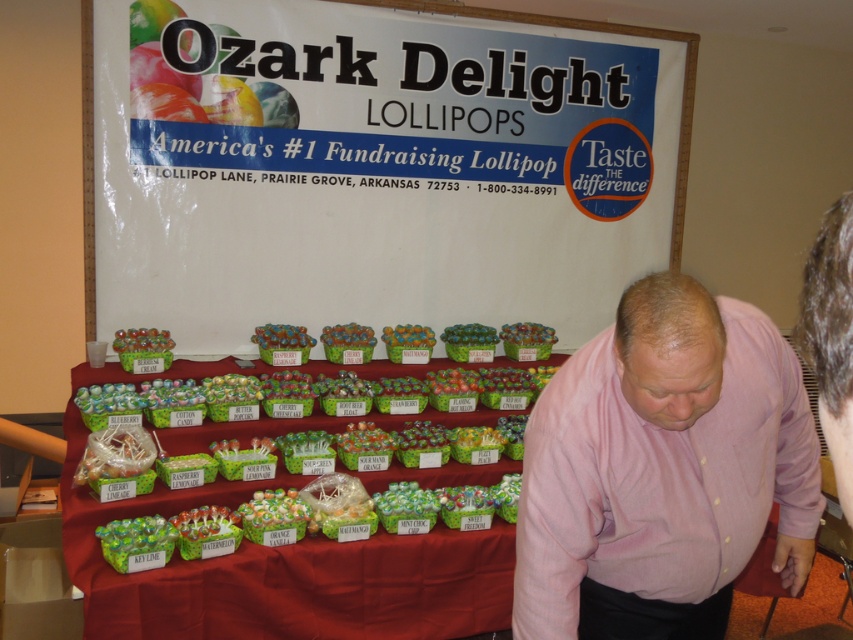
Question: Which point is farther to the camera?

Choices:
 (A) (131, 147)
 (B) (310, 628)
 (C) (703, 486)
 (D) (848, 324)

Answer: (A)

Question: Does pink cotton shirt at lower right have a larger size compared to green paper wrapped lollipops at center?

Choices:
 (A) yes
 (B) no

Answer: (B)

Question: Which object is farther from the camera taking this photo?

Choices:
 (A) white paperboard at upper center
 (B) pink cotton shirt at lower right
 (C) pink shirt at lower right
 (D) green paper wrapped lollipops at center

Answer: (A)

Question: Which point is farther from the camera taking this photo?

Choices:
 (A) (248, 483)
 (B) (677, 278)

Answer: (A)

Question: Does white paperboard at upper center appear on the left side of pink cotton shirt at lower right?

Choices:
 (A) yes
 (B) no

Answer: (A)

Question: Can you confirm if white paperboard at upper center is smaller than pink cotton shirt at lower right?

Choices:
 (A) yes
 (B) no

Answer: (B)